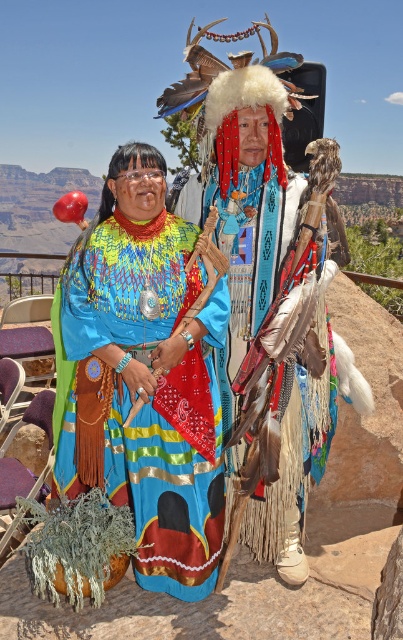
Question: Is matte blue fabric dress at center above multicolored woven dress at center?

Choices:
 (A) yes
 (B) no

Answer: (A)

Question: Which point is closer to the camera?

Choices:
 (A) multicolored woven dress at center
 (B) matte blue fabric dress at center

Answer: (B)

Question: Is matte blue fabric dress at center to the right of multicolored woven fabric at center from the viewer's perspective?

Choices:
 (A) yes
 (B) no

Answer: (B)

Question: Which of the following is the closest to the observer?

Choices:
 (A) multicolored woven dress at center
 (B) matte blue fabric dress at center
 (C) multicolored woven fabric at center

Answer: (B)

Question: Is matte blue fabric dress at center to the right of multicolored woven dress at center from the viewer's perspective?

Choices:
 (A) yes
 (B) no

Answer: (A)

Question: Which object is the farthest from the multicolored woven fabric at center?

Choices:
 (A) multicolored woven dress at center
 (B) matte blue fabric dress at center

Answer: (A)